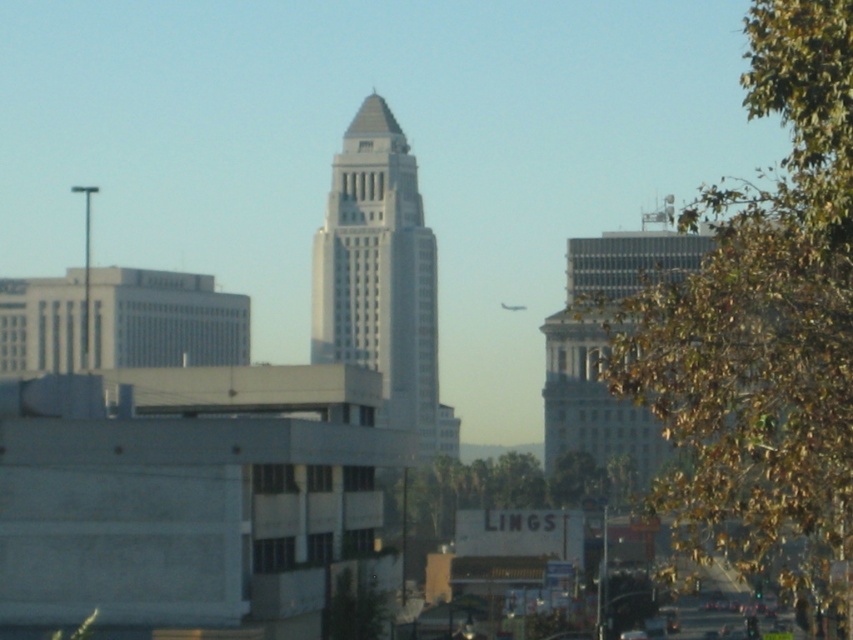
Question: Is the position of green leafy tree at upper right more distant than that of white smooth tower at center?

Choices:
 (A) yes
 (B) no

Answer: (B)

Question: Is green leafy tree at upper right to the right of white smooth tower at center from the viewer's perspective?

Choices:
 (A) yes
 (B) no

Answer: (A)

Question: Which point is closer to the camera?

Choices:
 (A) (347, 225)
 (B) (792, 170)

Answer: (B)

Question: In this image, where is green leafy tree at upper right located relative to white smooth tower at center?

Choices:
 (A) above
 (B) below

Answer: (B)